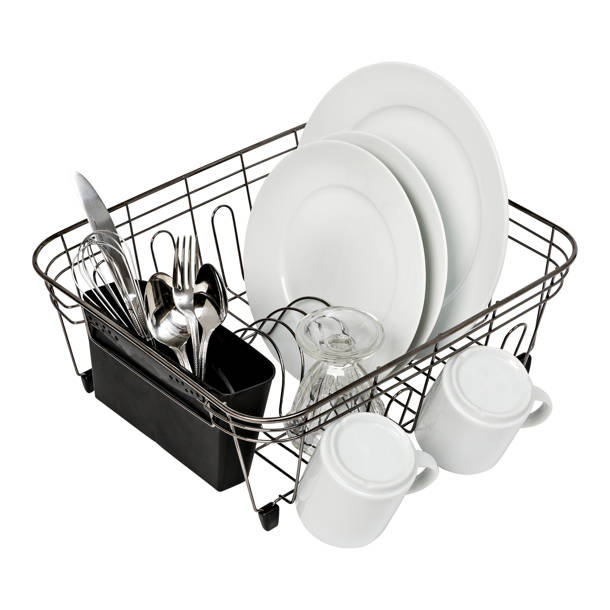
Identify the location of fork. This screenshot has height=610, width=610. (185, 292).